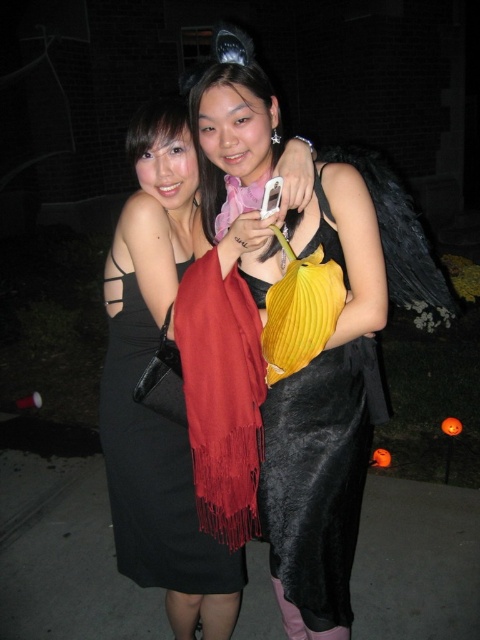
Question: Is velvet black dress at center closer to camera compared to black satin dress at center?

Choices:
 (A) no
 (B) yes

Answer: (A)

Question: Where is velvet black dress at center located in relation to black satin dress at center in the image?

Choices:
 (A) below
 (B) above

Answer: (A)

Question: Does velvet black dress at center have a smaller size compared to black satin dress at center?

Choices:
 (A) no
 (B) yes

Answer: (A)

Question: Which point appears farthest from the camera in this image?

Choices:
 (A) (363, 445)
 (B) (168, 536)

Answer: (B)

Question: Among these objects, which one is farthest from the camera?

Choices:
 (A) black satin dress at center
 (B) velvet black dress at center

Answer: (B)

Question: Which object appears closest to the camera in this image?

Choices:
 (A) velvet black dress at center
 (B) black satin dress at center

Answer: (B)